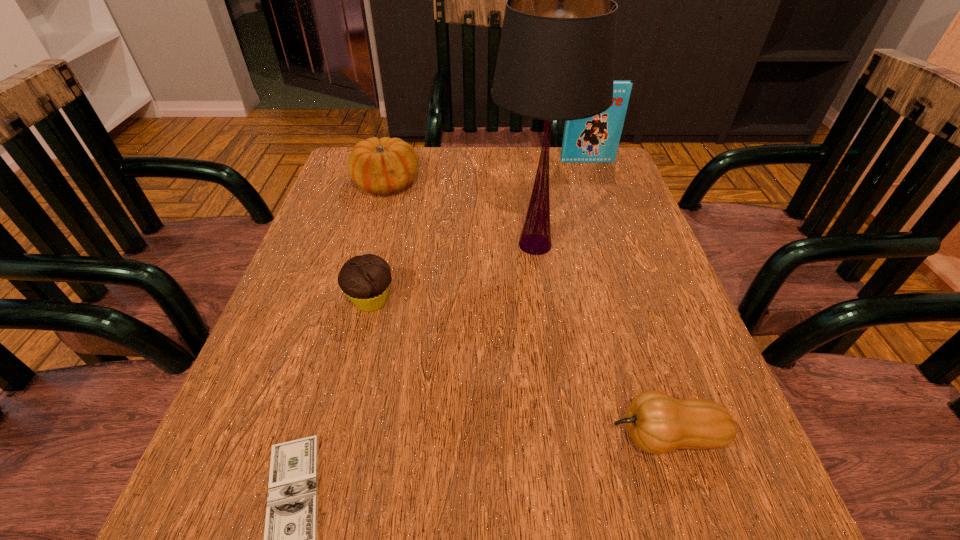
Locate an element on the screen. This screenshot has width=960, height=540. lampshade is located at coordinates (556, 57).

This screenshot has width=960, height=540. In order to click on the tallest object in this screenshot , I will do `click(556, 57)`.

Where is `book`? The height and width of the screenshot is (540, 960). book is located at coordinates (595, 139).

Locate an element on the screen. The image size is (960, 540). the farthest object is located at coordinates pos(595,139).

This screenshot has width=960, height=540. What are the coordinates of `the left gourd` in the screenshot? It's located at (382, 166).

Find the location of `the fifth nearest object`. the fifth nearest object is located at coordinates (382, 166).

At what (x,y) coordinates should I click in order to perform the action: click on the fourth farthest object. Please return your answer as a coordinate pair (x, y). Looking at the image, I should click on (366, 279).

This screenshot has height=540, width=960. What are the coordinates of `the right gourd` in the screenshot? It's located at (657, 423).

Locate an element on the screen. the nearer gourd is located at coordinates (657, 423).

Find the location of a particular element. free space located 0.230m on the front-facing side of the fourth nearest object is located at coordinates 554,379.